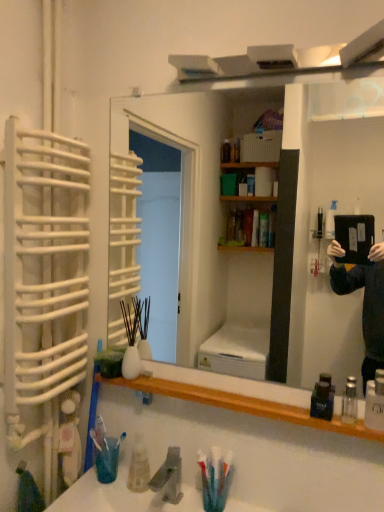
Describe the element at coordinates (350, 401) in the screenshot. I see `clear glass bottle at lower right, placed as the first mouthwash when sorted from right to left` at that location.

What do you see at coordinates (323, 398) in the screenshot? This screenshot has width=384, height=512. I see `dark blue plastic mouthwash at lower right, which ranks as the first mouthwash in left-to-right order` at bounding box center [323, 398].

The height and width of the screenshot is (512, 384). I want to click on dark blue plastic mouthwash at lower right, which ranks as the first mouthwash in left-to-right order, so click(x=323, y=398).

Locate an element on the screen. The image size is (384, 512). white plastic toothbrush at left, positioned as the 2th toothbrush in right-to-left order is located at coordinates [x=92, y=416].

This screenshot has height=512, width=384. What do you see at coordinates (267, 214) in the screenshot?
I see `wooden mirror at center` at bounding box center [267, 214].

Image resolution: width=384 pixels, height=512 pixels. Describe the element at coordinates (104, 453) in the screenshot. I see `translucent plastic toothbrush at lower left, which is counted as the first toothbrush, starting from the right` at that location.

Measure the distance between point [367,413] and camera.

3.53 feet.

Image resolution: width=384 pixels, height=512 pixels. What are the coordinates of `clear plastic sink at lower center` in the screenshot? It's located at (121, 497).

Is clear plastic bottles at lower right not within clear plastic sink at lower center?

Absolutely, clear plastic bottles at lower right is external to clear plastic sink at lower center.

Between clear plastic bottles at lower right and clear plastic sink at lower center, which one has smaller width?

With smaller width is clear plastic bottles at lower right.

Considering the positions of objects clear plastic bottles at lower right and clear plastic sink at lower center in the image provided, who is more to the left, clear plastic bottles at lower right or clear plastic sink at lower center?

clear plastic sink at lower center.

Which is behind, point (116, 467) or point (90, 409)?

Positioned behind is point (90, 409).

Based on the photo, is white plastic toothbrush at left, the first toothbrush positioned from the left, at the back of translucent plastic toothbrush at lower left, placed as the 2th toothbrush when sorted from left to right?

No, translucent plastic toothbrush at lower left, placed as the 2th toothbrush when sorted from left to right, is not facing the opposite direction of white plastic toothbrush at left, the first toothbrush positioned from the left.

Which object is thinner, translucent plastic toothbrush at lower left, which is counted as the first toothbrush, starting from the right, or white plastic toothbrush at left, the first toothbrush positioned from the left?

With smaller width is translucent plastic toothbrush at lower left, which is counted as the first toothbrush, starting from the right.

How many degrees apart are the facing directions of translucent plastic toothbrush at lower left, placed as the 2th toothbrush when sorted from left to right, and white plastic toothbrush at left, positioned as the 2th toothbrush in right-to-left order?

2.26 degrees separate the facing orientations of translucent plastic toothbrush at lower left, placed as the 2th toothbrush when sorted from left to right, and white plastic toothbrush at left, positioned as the 2th toothbrush in right-to-left order.

Looking at their sizes, would you say gray matte faucet at lower center is wider or thinner than white plastic toothbrush at left, positioned as the 2th toothbrush in right-to-left order?

Considering their sizes, gray matte faucet at lower center looks broader than white plastic toothbrush at left, positioned as the 2th toothbrush in right-to-left order.

Is gray matte faucet at lower center located outside white plastic toothbrush at left, the first toothbrush positioned from the left?

gray matte faucet at lower center is positioned outside white plastic toothbrush at left, the first toothbrush positioned from the left.

Is point (171, 502) closer or farther from the camera than point (89, 435)?

Point (171, 502) is closer to the camera than point (89, 435).

Between gray matte faucet at lower center and white plastic toothbrush at left, the first toothbrush positioned from the left, which one appears on the right side from the viewer's perspective?

Positioned to the right is gray matte faucet at lower center.

How far apart are translucent plastic toothbrush at lower left, placed as the 2th toothbrush when sorted from left to right, and dark blue plastic mouthwash at lower right, the 2th mouthwash in the right-to-left sequence?

translucent plastic toothbrush at lower left, placed as the 2th toothbrush when sorted from left to right, and dark blue plastic mouthwash at lower right, the 2th mouthwash in the right-to-left sequence, are 26.34 inches apart from each other.

Can you confirm if translucent plastic toothbrush at lower left, placed as the 2th toothbrush when sorted from left to right, is smaller than dark blue plastic mouthwash at lower right, the 2th mouthwash in the right-to-left sequence?

Actually, translucent plastic toothbrush at lower left, placed as the 2th toothbrush when sorted from left to right, might be larger than dark blue plastic mouthwash at lower right, the 2th mouthwash in the right-to-left sequence.

From a real-world perspective, which object stands above the other?

dark blue plastic mouthwash at lower right, which ranks as the first mouthwash in left-to-right order, is physically above.

Is translucent plastic toothbrush at lower left, which is counted as the first toothbrush, starting from the right, turned away from dark blue plastic mouthwash at lower right, the 2th mouthwash in the right-to-left sequence?

translucent plastic toothbrush at lower left, which is counted as the first toothbrush, starting from the right, does not have its back to dark blue plastic mouthwash at lower right, the 2th mouthwash in the right-to-left sequence.

Is clear plastic sink at lower center looking in the opposite direction of wooden shelf at lower center?

clear plastic sink at lower center is not turned away from wooden shelf at lower center.

In the image, there is a clear plastic sink at lower center. Identify the location of bookshelf above it (from the image's perspective). The width and height of the screenshot is (384, 512). (242, 397).

Is clear plastic sink at lower center smaller than wooden shelf at lower center?

No.

Considering the positions of objects translucent plastic toothbrush at lower left, placed as the 2th toothbrush when sorted from left to right, and clear plastic bottles at lower right in the image provided, who is behind, translucent plastic toothbrush at lower left, placed as the 2th toothbrush when sorted from left to right, or clear plastic bottles at lower right?

Positioned behind is translucent plastic toothbrush at lower left, placed as the 2th toothbrush when sorted from left to right.

Does translucent plastic toothbrush at lower left, placed as the 2th toothbrush when sorted from left to right, have a greater width compared to clear plastic bottles at lower right?

No.

Considering the positions of point (95, 452) and point (373, 428), is point (95, 452) closer or farther from the camera than point (373, 428)?

Point (95, 452) is farther from the camera than point (373, 428).

From a real-world perspective, is wooden shelf at lower center physically above wooden mirror at center?

No, from a real-world perspective, wooden shelf at lower center is not above wooden mirror at center.

In the image, there is a wooden shelf at lower center. Where is `mirror above it (from the image's perspective)`? mirror above it (from the image's perspective) is located at coordinates (267, 214).

Which is in front, wooden shelf at lower center or wooden mirror at center?

wooden mirror at center is more forward.

From the image's perspective, between wooden shelf at lower center and wooden mirror at center, who is located below?

wooden shelf at lower center.

You are a GUI agent. You are given a task and a screenshot of the screen. Output one action in this format:
    pyautogui.click(x=<x>, y=<y>)
    Task: Click on the toiletry on the right of clear plastic sink at lower center
    
    Given the screenshot: What is the action you would take?
    pyautogui.click(x=375, y=404)

I want to click on toothbrush on the left side of translucent plastic toothbrush at lower left, placed as the 2th toothbrush when sorted from left to right, so click(92, 416).

Looking at this image, estimate the real-world distances between objects in this image. Which object is closer to clear plastic bottles at lower right, wooden mirror at center or clear plastic sink at lower center?

clear plastic sink at lower center lies closer to clear plastic bottles at lower right than the other object.

Estimate the real-world distances between objects in this image. Which object is further from clear plastic sink at lower center, clear plastic bottles at lower right or wooden shelf at lower center?

clear plastic bottles at lower right lies further to clear plastic sink at lower center than the other object.

Considering their positions, is translucent plastic toothbrush at lower left, placed as the 2th toothbrush when sorted from left to right, positioned closer to dark blue plastic mouthwash at lower right, which ranks as the first mouthwash in left-to-right order, than clear glass bottle at lower right, placed as the first mouthwash when sorted from right to left?

clear glass bottle at lower right, placed as the first mouthwash when sorted from right to left, is closer to dark blue plastic mouthwash at lower right, which ranks as the first mouthwash in left-to-right order.

Based on their spatial positions, is translucent plastic toothbrush at lower left, which is counted as the first toothbrush, starting from the right, or wooden shelf at lower center closer to clear glass bottle at lower right, positioned as the second mouthwash in left-to-right order?

wooden shelf at lower center lies closer to clear glass bottle at lower right, positioned as the second mouthwash in left-to-right order, than the other object.

Looking at the image, which one is located further to wooden mirror at center, clear plastic bottles at lower right or translucent plastic toothbrush at lower left, placed as the 2th toothbrush when sorted from left to right?

clear plastic bottles at lower right is positioned further to the anchor wooden mirror at center.

Based on their spatial positions, is translucent plastic toothbrush at lower left, which is counted as the first toothbrush, starting from the right, or white plastic toothbrush at left, positioned as the 2th toothbrush in right-to-left order, further from clear glass bottle at lower right, positioned as the second mouthwash in left-to-right order?

white plastic toothbrush at left, positioned as the 2th toothbrush in right-to-left order.

When comparing their distances from wooden mirror at center, does clear plastic bottles at lower right or clear plastic sink at lower center seem closer?

clear plastic sink at lower center.

When comparing their distances from translucent plastic toothbrush at lower left, placed as the 2th toothbrush when sorted from left to right, does dark blue plastic mouthwash at lower right, the 2th mouthwash in the right-to-left sequence, or clear glass bottle at lower right, positioned as the second mouthwash in left-to-right order, seem closer?

dark blue plastic mouthwash at lower right, the 2th mouthwash in the right-to-left sequence, lies closer to translucent plastic toothbrush at lower left, placed as the 2th toothbrush when sorted from left to right, than the other object.

The height and width of the screenshot is (512, 384). I want to click on sink located between white plastic toothbrush at left, the first toothbrush positioned from the left, and clear glass bottle at lower right, placed as the first mouthwash when sorted from right to left, in the left-right direction, so click(121, 497).

Find the location of a particular element. The image size is (384, 512). sink between translucent plastic toothbrush at lower left, which is counted as the first toothbrush, starting from the right, and clear plastic bottles at lower right is located at coordinates (121, 497).

The height and width of the screenshot is (512, 384). Identify the location of toiletry between wooden mirror at center and dark blue plastic mouthwash at lower right, which ranks as the first mouthwash in left-to-right order, in the up-down direction. (375, 404).

Image resolution: width=384 pixels, height=512 pixels. In order to click on bookshelf between clear plastic sink at lower center and white plastic toothbrush at left, positioned as the 2th toothbrush in right-to-left order, along the z-axis in this screenshot , I will do `click(242, 397)`.